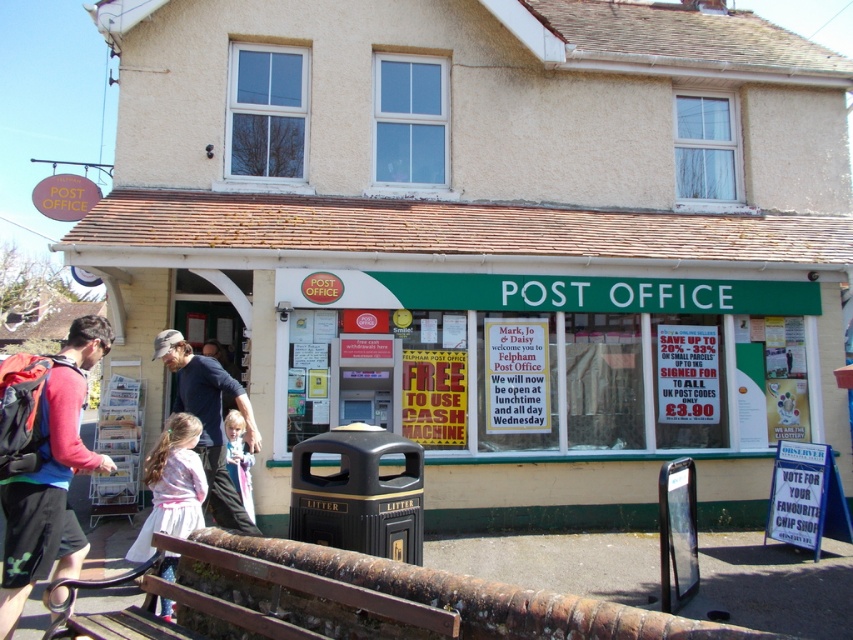
Question: Does rusty metal bench at lower left appear under red backpack at left?

Choices:
 (A) no
 (B) yes

Answer: (B)

Question: Can you confirm if red backpack at left is positioned above light pink fabric at lower left?

Choices:
 (A) no
 (B) yes

Answer: (B)

Question: Is rusty metal bench at lower left smaller than light pink fabric at lower left?

Choices:
 (A) yes
 (B) no

Answer: (A)

Question: Estimate the real-world distances between objects in this image. Which object is farther from the rusty metal bench at lower left?

Choices:
 (A) red backpack at left
 (B) light pink fabric at lower left

Answer: (A)

Question: Which object is farther from the camera taking this photo?

Choices:
 (A) red backpack at left
 (B) light pink fabric at lower left

Answer: (B)

Question: Which point is closer to the camera?

Choices:
 (A) (9, 579)
 (B) (527, 586)
 (C) (242, 493)

Answer: (A)